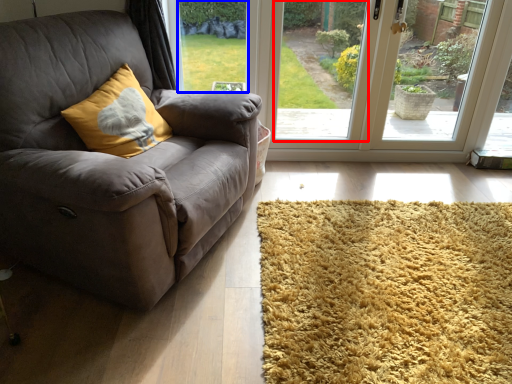
Question: Which of the following is the farthest to the observer, window screen (highlighted by a red box) or window screen (highlighted by a blue box)?

Choices:
 (A) window screen
 (B) window screen

Answer: (B)